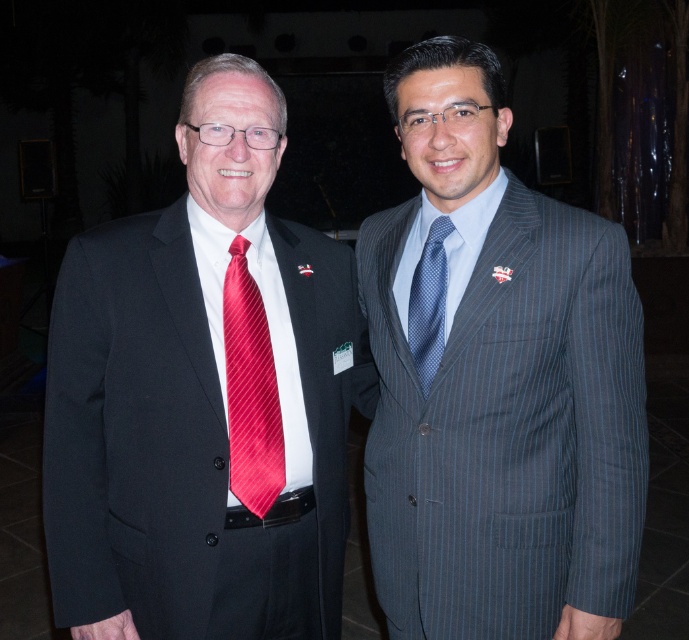
You are a photographer at an event and need to adjust the lighting to ensure both the shiny red tie at center and the blue dotted tie at center are visible. Since the background is dimly lit, which tie should you focus on first to ensure proper exposure?

The shiny red tie at center is in front of the blue dotted tie at center, so you should focus on the shiny red tie at center first to ensure it is properly exposed before adjusting for the blue dotted tie at center.